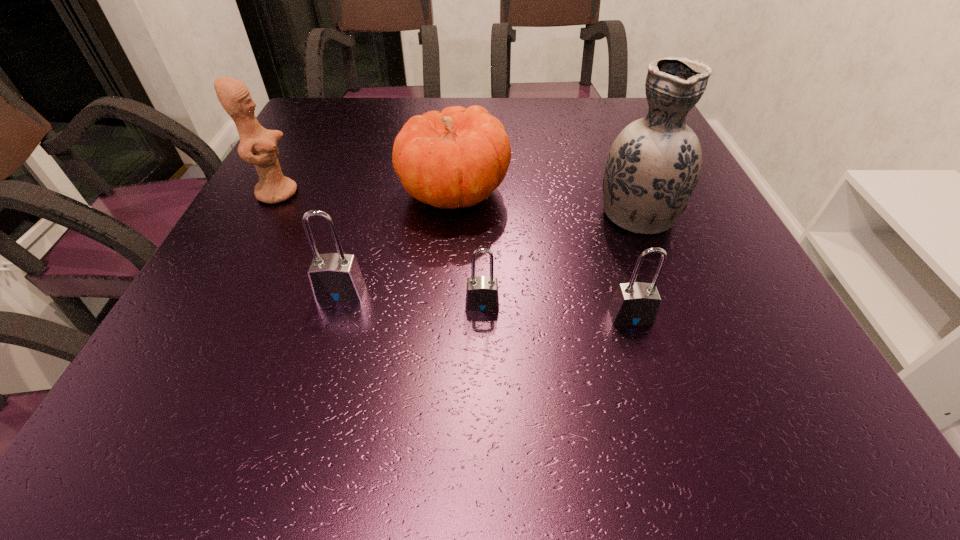
I want to click on the leftmost padlock, so click(x=334, y=277).

Where is `the shortest object`? the shortest object is located at coordinates click(482, 295).

Where is `the second padlock from right to left`? Image resolution: width=960 pixels, height=540 pixels. the second padlock from right to left is located at coordinates (482, 295).

The width and height of the screenshot is (960, 540). Identify the location of the second shortest padlock. (636, 303).

This screenshot has height=540, width=960. In order to click on pumpkin in this screenshot , I will do pos(457,158).

At what (x,y) coordinates should I click in order to perform the action: click on the tallest object. Please return your answer as a coordinate pair (x, y). Image resolution: width=960 pixels, height=540 pixels. Looking at the image, I should click on (653, 166).

Where is `figurine`? The height and width of the screenshot is (540, 960). figurine is located at coordinates (258, 146).

Find the location of a particular element. The width and height of the screenshot is (960, 540). the fifth shortest object is located at coordinates (258, 146).

This screenshot has height=540, width=960. I want to click on vacant space situated 0.060m on the shackle of the leftmost padlock, so click(329, 332).

In order to click on vacant area situated on the shackle of the second padlock from left to right in this screenshot , I will do `click(483, 342)`.